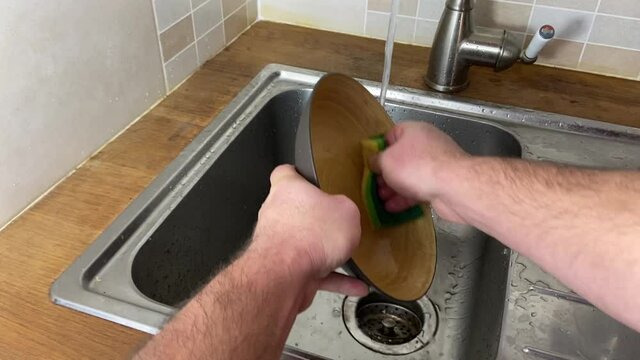
At what (x,y) coordinates should I click in order to perform the action: click on bowl. Please return your answer as a coordinate pair (x, y). The height and width of the screenshot is (360, 640). Looking at the image, I should click on (409, 270).